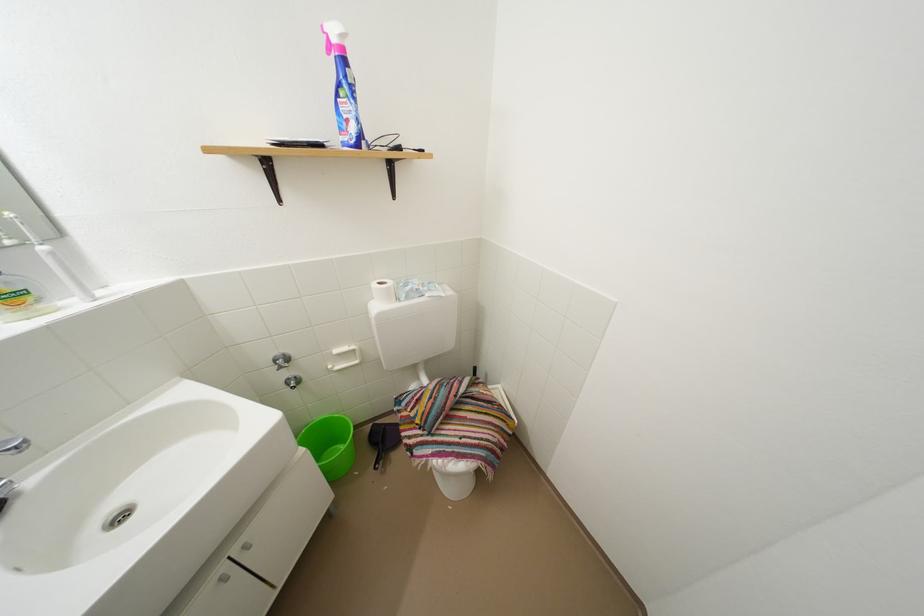
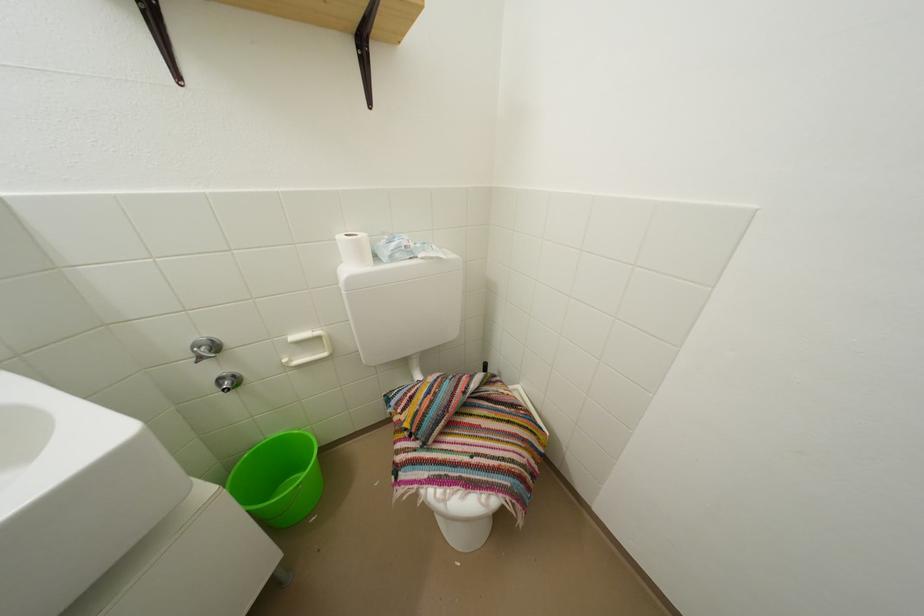
Where in the second image is the point corresponding to (x=388, y=289) from the first image?

(360, 240)